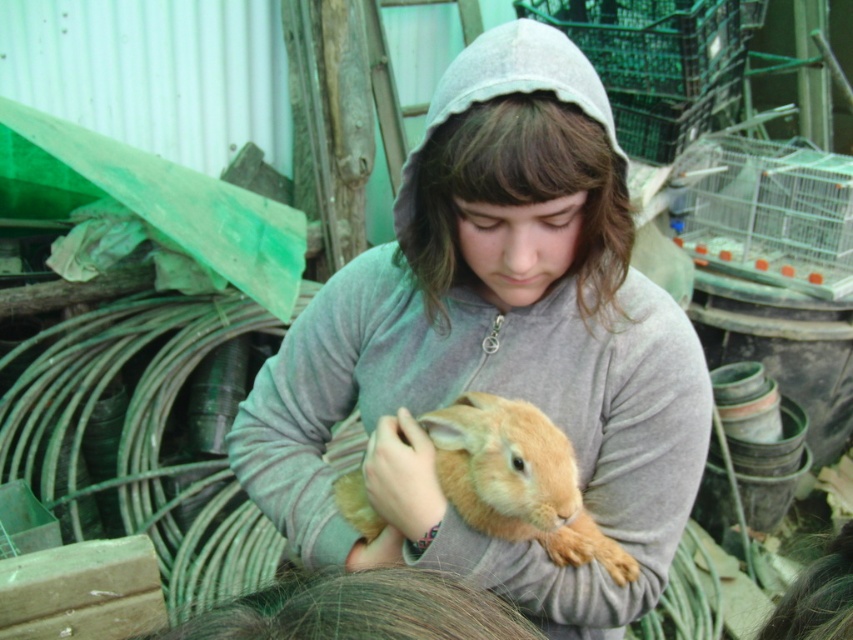
Based on the photo, you are designing a new outfit and need to know the relative sizes of the items in the image. Based on the scene, is the matte gray hoodie at center wider than the light brown fur at center?

The matte gray hoodie at center is wider than the light brown fur at center according to the description.

In the scene where a person is holding a small orange rabbit in a backyard setting, can you determine which object is positioned to the left when observing the matte gray hoodie at center and the light brown fur at center?

The matte gray hoodie at center is positioned to the left of the light brown fur at center.

You are a delivery robot that needs to place a small package between the matte gray hoodie at center and the light brown fur at center. The package is 5 inches long. Can you fit it in the space between them?

The matte gray hoodie at center is 4.68 inches away from light brown fur at center. Since the package is 5 inches long, it cannot fit between them as the distance is shorter than the package length.